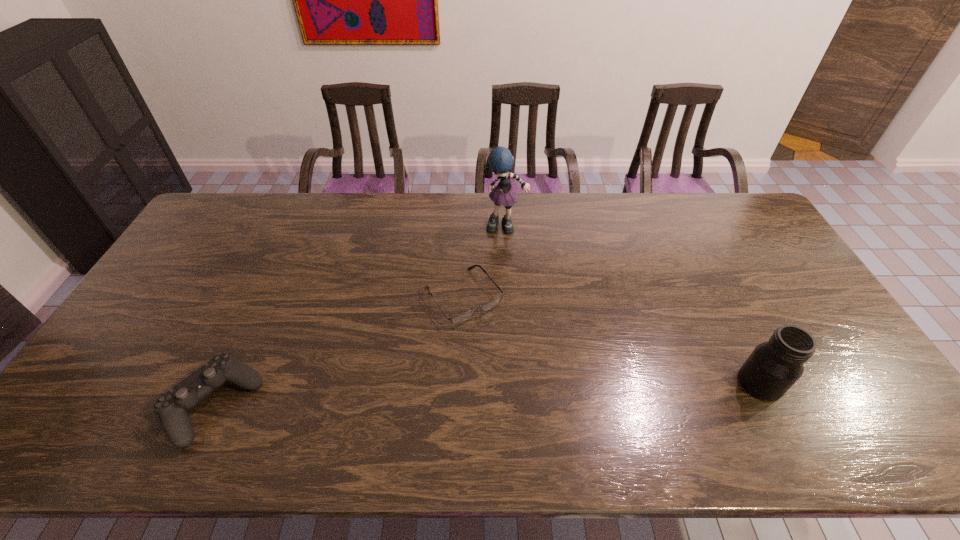
Image resolution: width=960 pixels, height=540 pixels. In order to click on vacant space on the desktop that is between the third tallest object and the jar and is positioned on the front-facing side of the spectacles in this screenshot , I will do `click(538, 392)`.

At what (x,y) coordinates should I click in order to perform the action: click on vacant space on the desktop that is between the leftmost object and the second tallest object and is positioned on the front-facing side of the tallest object. Please return your answer as a coordinate pair (x, y). The image size is (960, 540). Looking at the image, I should click on pyautogui.click(x=537, y=392).